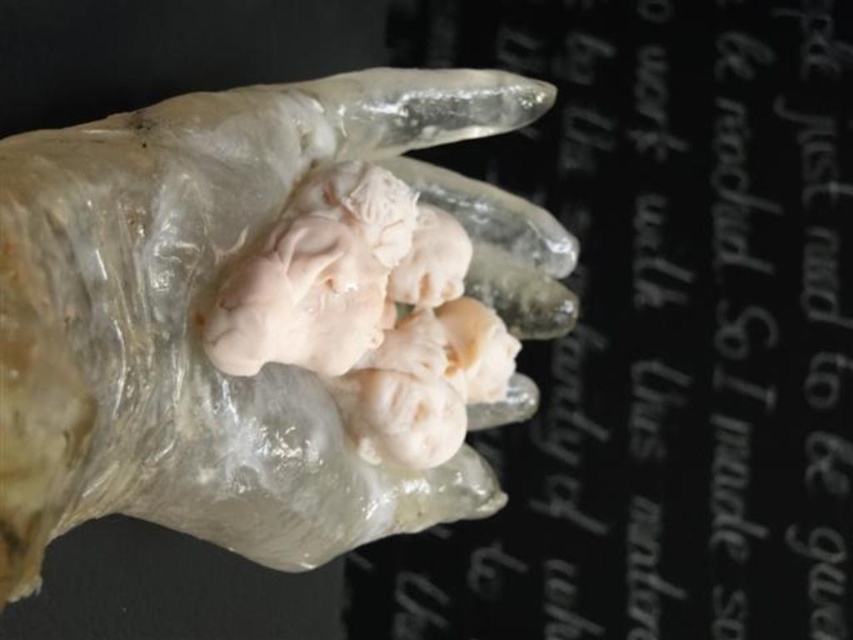
You are an inspector checking the packaging of a product. You notice the black glossy text at upper center and the translucent rubber hand at center. Which one is taller?

The black glossy text at upper center has a greater height compared to the translucent rubber hand at center, so the black glossy text at upper center is taller.

You are a quality inspector examining gloves in a factory. You notice the black glossy text at upper center and the translucent rubber hand at center. Which object is closer to you?

The black glossy text at upper center is closer to you because it is further to the viewer than the translucent rubber hand at center.

You are a quality inspector examining a product packaging image. The packaging has important information that needs to be clearly visible. Based on the image, is the black glossy text at upper center readable over the translucent rubber hand at center?

The black glossy text at upper center is positioned over the translucent rubber hand at center, which may cause the text to blend in with the hand, making it less readable. To ensure clarity, the text should be placed in an area without overlapping objects.